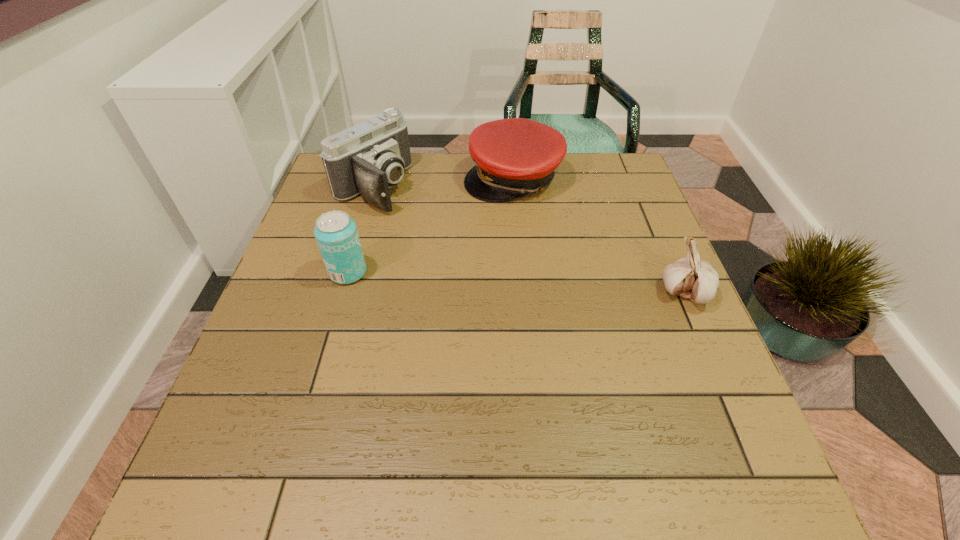
Locate an element on the screen. The width and height of the screenshot is (960, 540). unoccupied area between the camera and the beer can is located at coordinates (360, 230).

You are a GUI agent. You are given a task and a screenshot of the screen. Output one action in this format:
    pyautogui.click(x=<x>, y=<y>)
    Task: Click on the vacant space in between the second object from right to left and the garlic
    
    Given the screenshot: What is the action you would take?
    pyautogui.click(x=599, y=236)

In order to click on vacant area that lies between the garlic and the cap in this screenshot , I will do `click(599, 236)`.

Find the location of `empty space that is in between the beer can and the garlic`. empty space that is in between the beer can and the garlic is located at coordinates (516, 283).

In order to click on object that is the closest one to the cap in this screenshot , I will do `click(369, 158)`.

Identify which object is located as the third nearest to the camera. Please provide its 2D coordinates. Your answer should be formatted as a tuple, i.e. [(x, y)], where the tuple contains the x and y coordinates of a point satisfying the conditions above.

[(692, 278)]

Find the location of a particular element. blank area in the image that satisfies the following two spatial constraints: 1. on the back side of the camera; 2. on the left side of the cap is located at coordinates (375, 179).

Locate an element on the screen. The height and width of the screenshot is (540, 960). free region that satisfies the following two spatial constraints: 1. on the back side of the beer can; 2. on the left side of the second object from right to left is located at coordinates (375, 179).

Locate an element on the screen. This screenshot has height=540, width=960. vacant space that satisfies the following two spatial constraints: 1. on the back side of the second object from right to left; 2. on the left side of the beer can is located at coordinates (375, 179).

Identify the location of free space in the image that satisfies the following two spatial constraints: 1. on the front side of the rightmost object; 2. on the left side of the beer can. (342, 293).